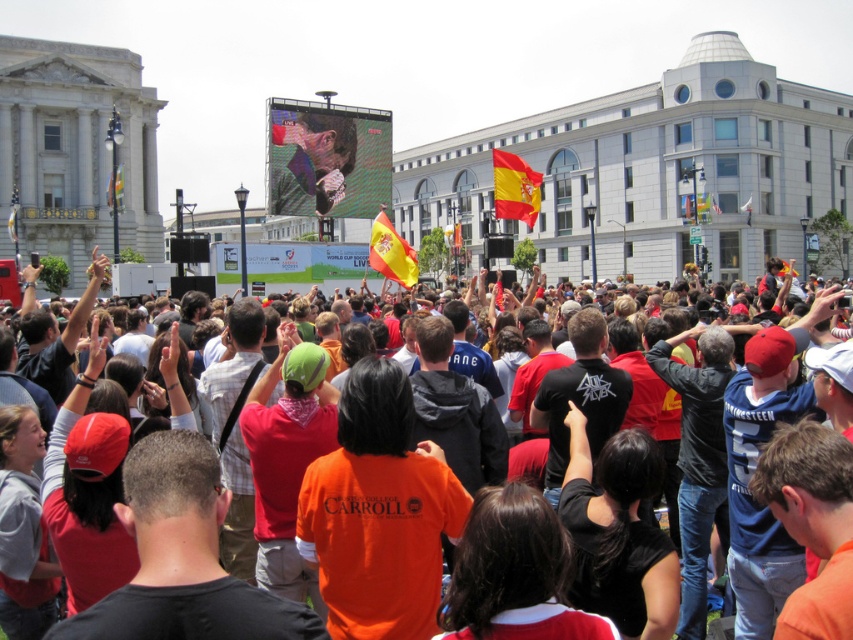
Question: Estimate the real-world distances between objects in this image. Which object is farther from the matte black screen at center?

Choices:
 (A) red fabric flag at center
 (B) yellowmaterial/textureflag at center

Answer: (A)

Question: Can you confirm if red fabric flag at center is positioned below yellow fabric flag at center?

Choices:
 (A) yes
 (B) no

Answer: (B)

Question: Is matte black screen at center bigger than red fabric flag at center?

Choices:
 (A) yes
 (B) no

Answer: (B)

Question: Among these objects, which one is farthest from the camera?

Choices:
 (A) yellow fabric flag at center
 (B) matte black screen at center

Answer: (B)

Question: Among these points, which one is nearest to the camera?

Choices:
 (A) (117, 173)
 (B) (405, 260)

Answer: (A)

Question: Does matte black screen at center appear over yellow fabric flag at center?

Choices:
 (A) yes
 (B) no

Answer: (A)